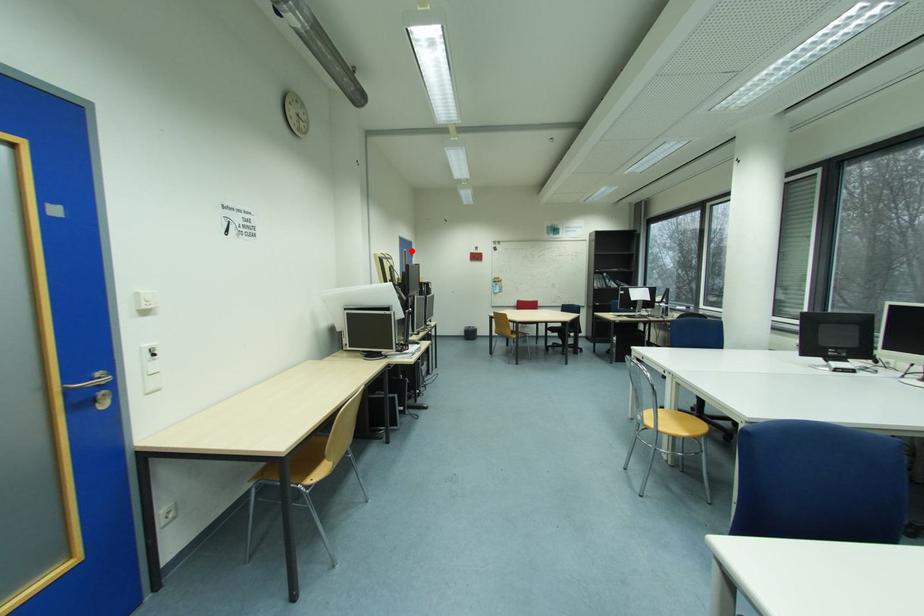
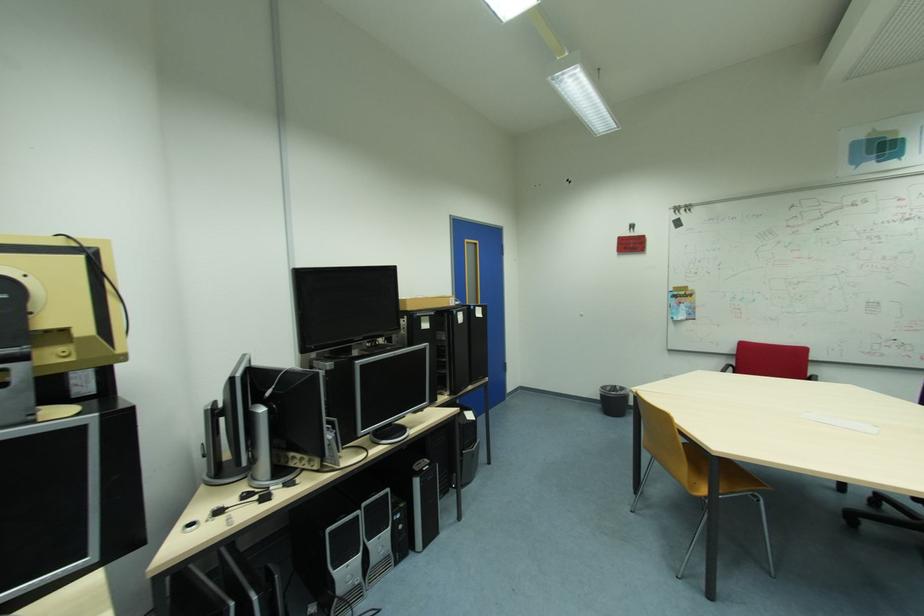
Find the pixel in the second image that matches the highlighted location in the first image.

(473, 241)